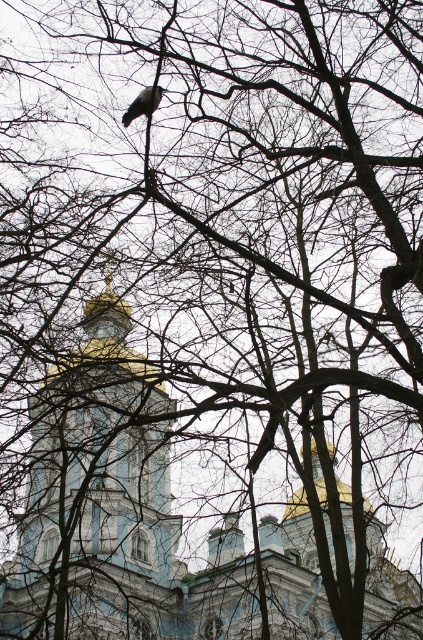
Where is `blue painted stone tower at center`? blue painted stone tower at center is located at coordinates (96, 496).

Who is positioned more to the right, blue painted stone tower at center or gray matte pigeon at upper center?

gray matte pigeon at upper center

Who is more distant from viewer, [142,596] or [150,100]?

Positioned behind is point [142,596].

Locate an element on the screen. The width and height of the screenshot is (423, 640). blue painted stone tower at center is located at coordinates (96, 496).